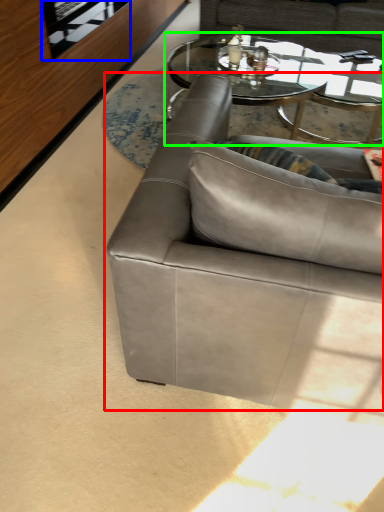
Question: Based on their relative distances, which object is nearer to studio couch (highlighted by a red box)? Choose from glass door (highlighted by a blue box) and coffee table (highlighted by a green box).

Choices:
 (A) glass door
 (B) coffee table

Answer: (A)